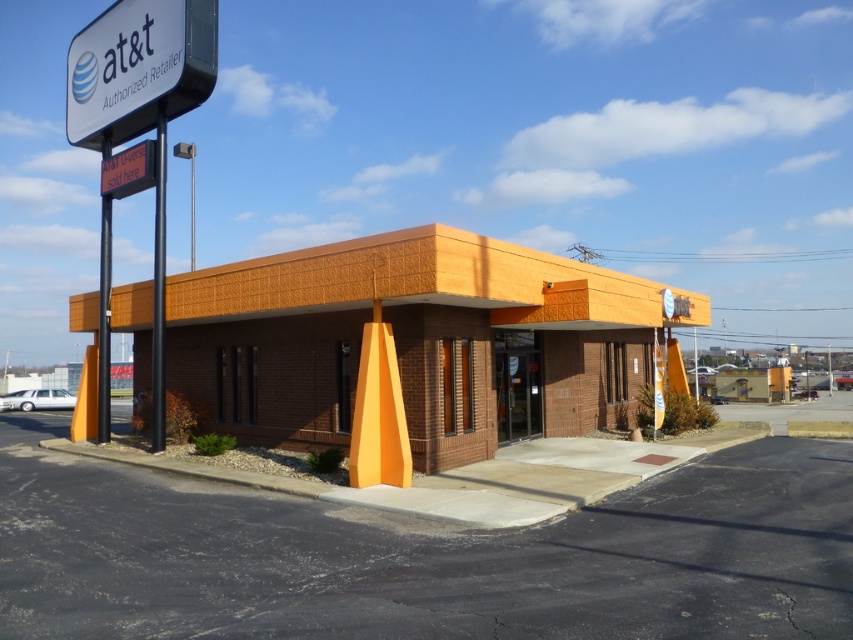
Based on the photo, what is the position of the white plastic sign at upper left relative to the orange digital sign at upper left?

The white plastic sign at upper left is positioned to the right of the orange digital sign at upper left.

You are a delivery person arriving at the AT amp amp T Authorized Retailer store. You need to park your van in the parking lot. However, you notice the orange brick motel at center and the white plastic sign at upper left. Which object should you avoid hitting when backing into a parking spot near the entrance?

You should avoid hitting the orange brick motel at center because it is larger in size than the white plastic sign at upper left and more likely to cause significant damage if collided with.

You are a delivery driver approaching the AT T Authorized Retailer store. You need to park your truck in the parking lot in front of the orange brick motel at center. Since the parking lot is paved, will the orange digital sign at upper left block your path to the motel?

The orange brick motel at center is larger than the orange digital sign at upper left, so the sign is less likely to block your path to the motel.